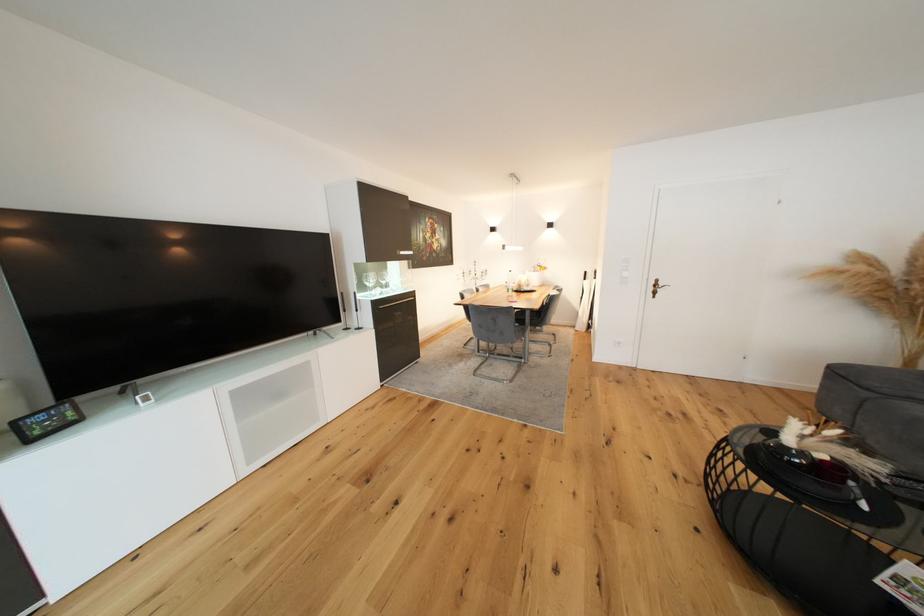
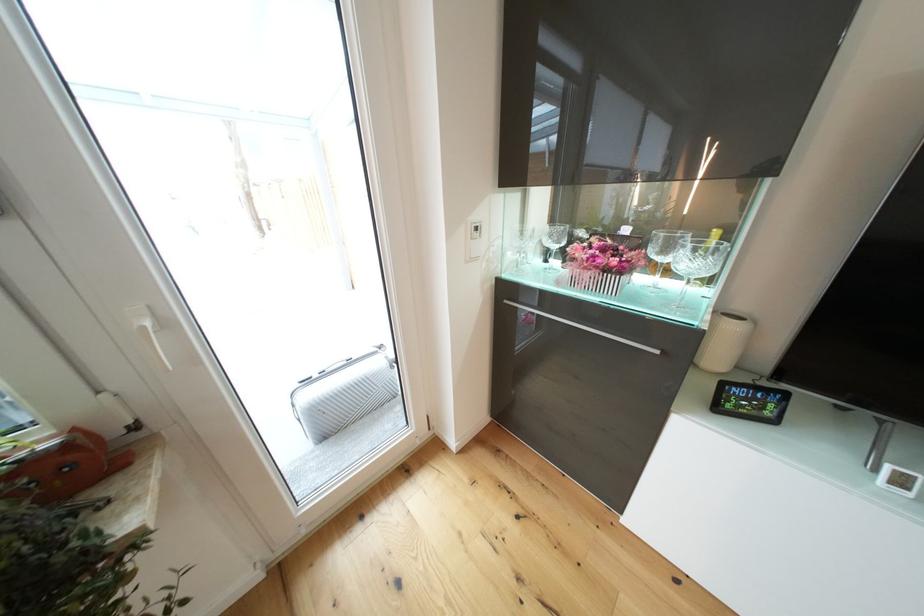
The images are taken continuously from a first-person perspective. In which direction is your viewpoint rotating?

The camera rotated toward left-down.